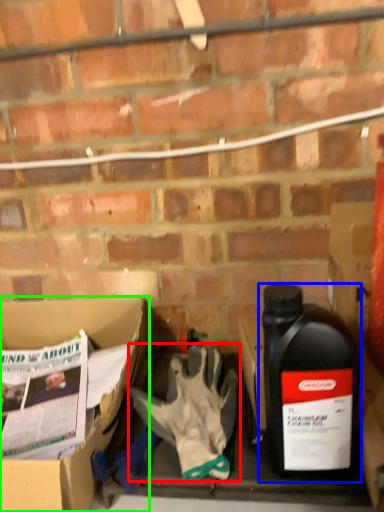
Question: Which object is the closest to the glove (highlighted by a red box)? Choose among these: bottle (highlighted by a blue box) or box (highlighted by a green box).

Choices:
 (A) bottle
 (B) box

Answer: (A)